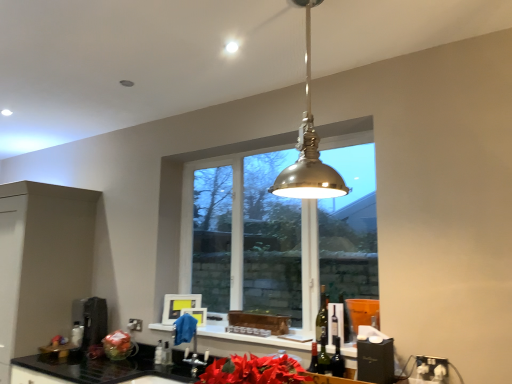
Question: Is polished brass pendant light at center far away from green glass bottle at center?

Choices:
 (A) no
 (B) yes

Answer: (A)

Question: From a real-world perspective, is polished brass pendant light at center beneath green glass bottle at center?

Choices:
 (A) yes
 (B) no

Answer: (B)

Question: Does polished brass pendant light at center have a lesser height compared to green glass bottle at center?

Choices:
 (A) yes
 (B) no

Answer: (B)

Question: Does polished brass pendant light at center have a greater width compared to green glass bottle at center?

Choices:
 (A) yes
 (B) no

Answer: (A)

Question: Is polished brass pendant light at center bigger than green glass bottle at center?

Choices:
 (A) yes
 (B) no

Answer: (A)

Question: Considering the positions of clear glass window at center and polished brass pendant light at center in the image, is clear glass window at center wider or thinner than polished brass pendant light at center?

Choices:
 (A) thin
 (B) wide

Answer: (A)

Question: Is point (264, 304) closer or farther from the camera than point (335, 180)?

Choices:
 (A) farther
 (B) closer

Answer: (A)

Question: Is clear glass window at center taller or shorter than polished brass pendant light at center?

Choices:
 (A) tall
 (B) short

Answer: (A)

Question: Is clear glass window at center situated inside polished brass pendant light at center or outside?

Choices:
 (A) inside
 (B) outside

Answer: (B)

Question: Does point (306, 69) appear closer or farther from the camera than point (88, 316)?

Choices:
 (A) farther
 (B) closer

Answer: (B)

Question: From a real-world perspective, relative to metallic stainless steel coffee machine at lower left, is polished brass pendant light at center vertically above or below?

Choices:
 (A) below
 (B) above

Answer: (B)

Question: From the image's perspective, is polished brass pendant light at center located above or below metallic stainless steel coffee machine at lower left?

Choices:
 (A) above
 (B) below

Answer: (A)

Question: Is polished brass pendant light at center wider or thinner than metallic stainless steel coffee machine at lower left?

Choices:
 (A) wide
 (B) thin

Answer: (A)

Question: Based on their sizes in the image, would you say matte black cabinet at left is bigger or smaller than clear glass bottle at lower center, which is counted as the 2th bottle, starting from the left?

Choices:
 (A) small
 (B) big

Answer: (B)

Question: Considering the positions of matte black cabinet at left and clear glass bottle at lower center, which is the 1th bottle from right to left, in the image, is matte black cabinet at left wider or thinner than clear glass bottle at lower center, which is the 1th bottle from right to left,?

Choices:
 (A) thin
 (B) wide

Answer: (B)